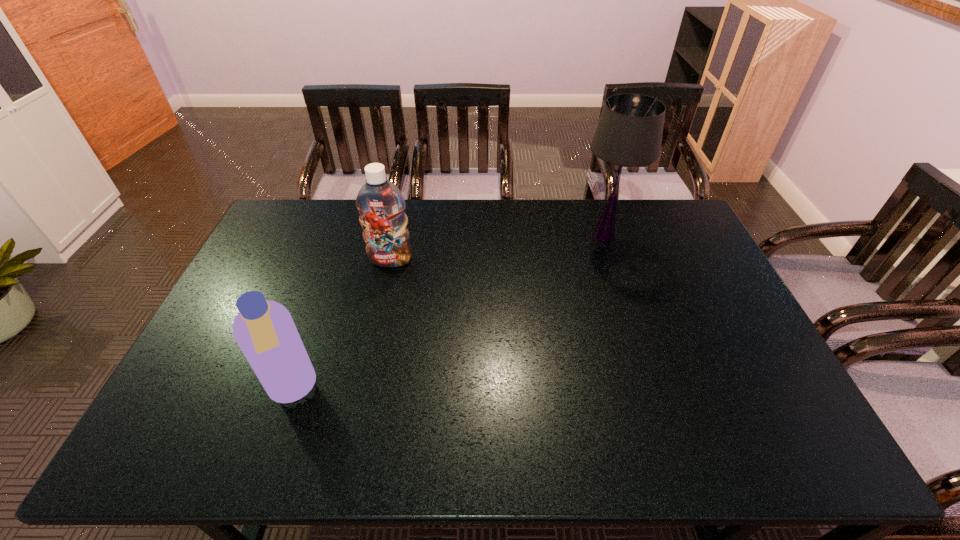
The width and height of the screenshot is (960, 540). I want to click on free spot that satisfies the following two spatial constraints: 1. on the front-facing side of the rightmost object; 2. on the front label of the farther shampoo, so click(612, 260).

At what (x,y) coordinates should I click in order to perform the action: click on free point that satisfies the following two spatial constraints: 1. on the front-facing side of the lampshade; 2. on the front label of the right shampoo. Please return your answer as a coordinate pair (x, y). The height and width of the screenshot is (540, 960). Looking at the image, I should click on (612, 260).

Where is `vacant space that satisfies the following two spatial constraints: 1. on the front-facing side of the rightmost object; 2. on the front label of the second object from right to left`? Image resolution: width=960 pixels, height=540 pixels. vacant space that satisfies the following two spatial constraints: 1. on the front-facing side of the rightmost object; 2. on the front label of the second object from right to left is located at coordinates (612, 260).